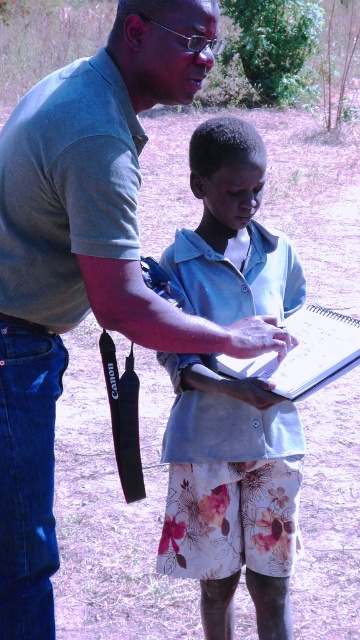
Question: Which point is closer to the camera?

Choices:
 (A) light blue fabric shirt at center
 (B) white paper clipboard at center

Answer: (B)

Question: Does light blue fabric shirt at center appear on the right side of white paper clipboard at center?

Choices:
 (A) yes
 (B) no

Answer: (B)

Question: In this image, where is light blue fabric shirt at center located relative to white paper clipboard at center?

Choices:
 (A) above
 (B) below

Answer: (B)

Question: Which of the following is the closest to the observer?

Choices:
 (A) white paper clipboard at center
 (B) light blue fabric shirt at center

Answer: (A)

Question: Which point appears closest to the camera in this image?

Choices:
 (A) (267, 380)
 (B) (259, 625)

Answer: (A)

Question: Can you confirm if light blue fabric shirt at center is smaller than white paper clipboard at center?

Choices:
 (A) no
 (B) yes

Answer: (A)